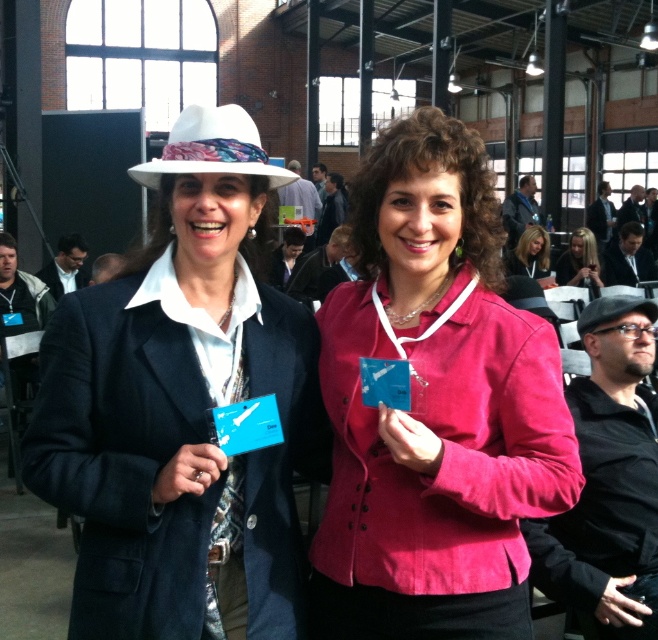
Question: Which object is closer to the camera taking this photo?

Choices:
 (A) matte black jacket at center
 (B) matte pink blazer at center
 (C) pink fabric jacket at center

Answer: (C)

Question: Which of the following is the farthest from the observer?

Choices:
 (A) black fabric hat at right
 (B) pink fabric jacket at center
 (C) white felt cowboy hat at upper left

Answer: (A)

Question: Is matte black jacket at center closer to the viewer compared to black fabric hat at right?

Choices:
 (A) yes
 (B) no

Answer: (B)

Question: Is white felt cowboy hat at upper left further to the viewer compared to matte black jacket at center?

Choices:
 (A) no
 (B) yes

Answer: (A)

Question: Observing the image, what is the correct spatial positioning of white felt cowboy hat at upper left in reference to matte pink blazer at center?

Choices:
 (A) right
 (B) left

Answer: (B)

Question: Which point is farther from the camera taking this photo?

Choices:
 (A) (201, 115)
 (B) (519, 268)

Answer: (B)